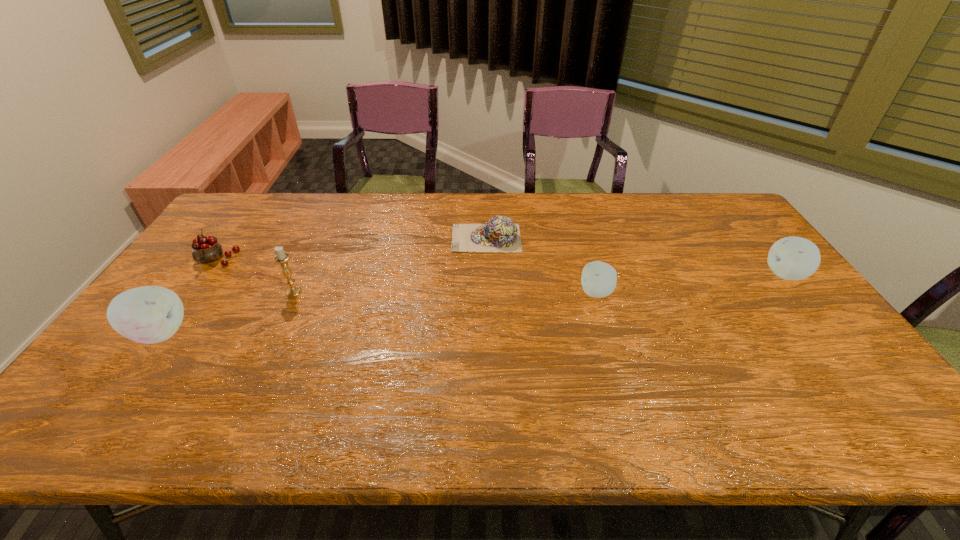
This screenshot has height=540, width=960. I want to click on vacant space located on the back of the tallest apple, so click(x=233, y=232).

Identify the location of vacant space situated 0.360m on the back of the second object from right to left. (574, 215).

Identify the location of free space located 0.330m on the front of the second tallest apple. (872, 382).

Locate an element on the screen. This screenshot has width=960, height=540. vacant position located 0.100m on the front of the fourth object from right to left is located at coordinates (279, 322).

This screenshot has height=540, width=960. I want to click on vacant space situated 0.150m on the handle side of the cherry, so click(x=183, y=306).

This screenshot has width=960, height=540. I want to click on vacant space located on the front, side, and top of the cap, so (401, 238).

Where is `vacant position located 0.110m on the front, side, and top of the cap`? vacant position located 0.110m on the front, side, and top of the cap is located at coordinates (419, 238).

I want to click on vacant space located on the front, side, and top of the cap, so click(419, 238).

Image resolution: width=960 pixels, height=540 pixels. I want to click on object that is at the far edge, so click(500, 234).

Find the location of a particular element. The image size is (960, 540). apple at the left edge is located at coordinates pyautogui.click(x=151, y=314).